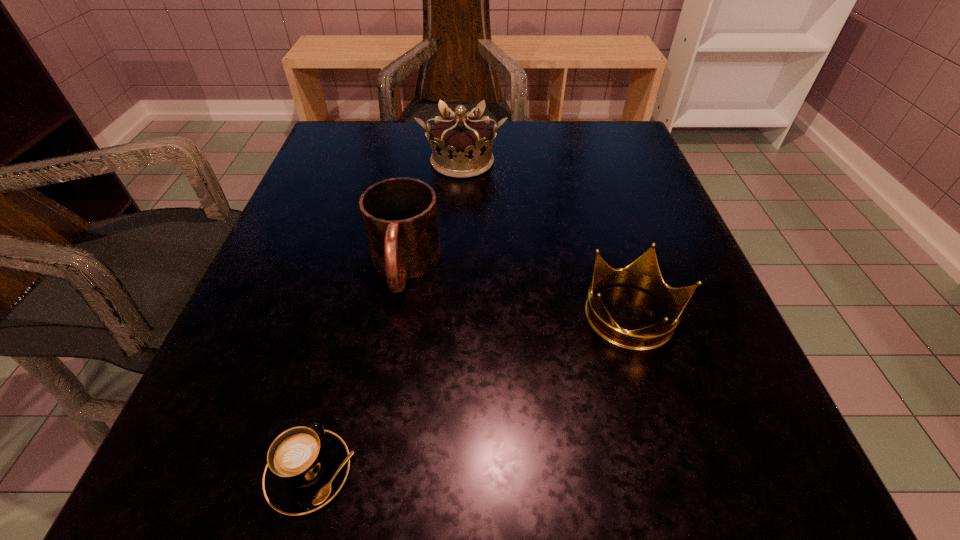
I want to click on vacant space located on the back of the cappuccino, so click(x=364, y=265).

I want to click on object at the far edge, so click(461, 145).

Identify the location of object that is at the near edge. This screenshot has width=960, height=540. (306, 467).

The height and width of the screenshot is (540, 960). I want to click on object that is at the left edge, so click(x=306, y=467).

Image resolution: width=960 pixels, height=540 pixels. Identify the location of object at the right edge. (644, 273).

The image size is (960, 540). I want to click on object present at the near left corner, so click(x=306, y=467).

I want to click on vacant space at the near edge of the desktop, so click(x=416, y=498).

Locate an element on the screen. This screenshot has width=960, height=540. free space at the left edge of the desktop is located at coordinates (320, 327).

Locate an element on the screen. blank area at the right edge is located at coordinates (618, 200).

Locate an element on the screen. vacant space at the near left corner of the desktop is located at coordinates (172, 480).